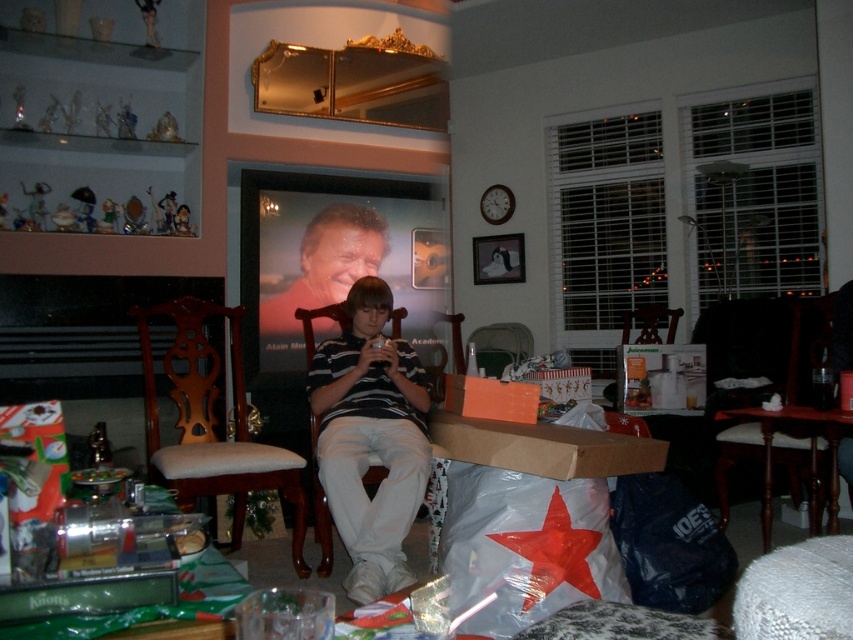
Question: Which of these objects is positioned farthest from the brown cardboard box at center?

Choices:
 (A) wooden armchair at center
 (B) wooden armchair at lower right
 (C) striped cotton shirt at center

Answer: (B)

Question: Can you confirm if wooden armchair at center is positioned to the right of wooden armchair at lower right?

Choices:
 (A) yes
 (B) no

Answer: (B)

Question: In this image, where is wooden armchair at lower right located relative to brown cardboard box at center?

Choices:
 (A) above
 (B) below

Answer: (A)

Question: Based on their relative distances, which object is nearer to the striped cotton shirt at center?

Choices:
 (A) wooden armchair at center
 (B) wooden armchair at lower right
 (C) brown cardboard box at center

Answer: (C)

Question: Which object is the closest to the brown cardboard box at center?

Choices:
 (A) wooden armchair at center
 (B) wooden armchair at lower right

Answer: (A)

Question: Does wooden armchair at center have a greater width compared to brown cardboard box at center?

Choices:
 (A) no
 (B) yes

Answer: (A)